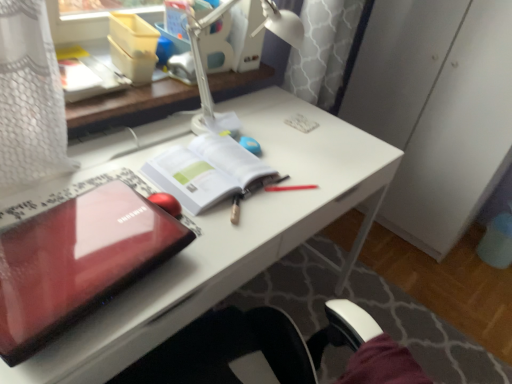
Question: Is glossy plastic laptop at left wider or thinner than glossy plastic laptop at center-left?

Choices:
 (A) thin
 (B) wide

Answer: (A)

Question: Choose the correct answer: Is glossy plastic laptop at left inside glossy plastic laptop at center-left or outside it?

Choices:
 (A) outside
 (B) inside

Answer: (A)

Question: Based on their relative distances, which object is nearer to the white paper at center?

Choices:
 (A) white plastic lamp at upper center
 (B) glossy plastic laptop at left
 (C) glossy plastic laptop at center-left

Answer: (C)

Question: Which object is positioned closest to the glossy plastic laptop at center-left?

Choices:
 (A) glossy plastic laptop at left
 (B) white plastic lamp at upper center
 (C) white paper at center

Answer: (C)